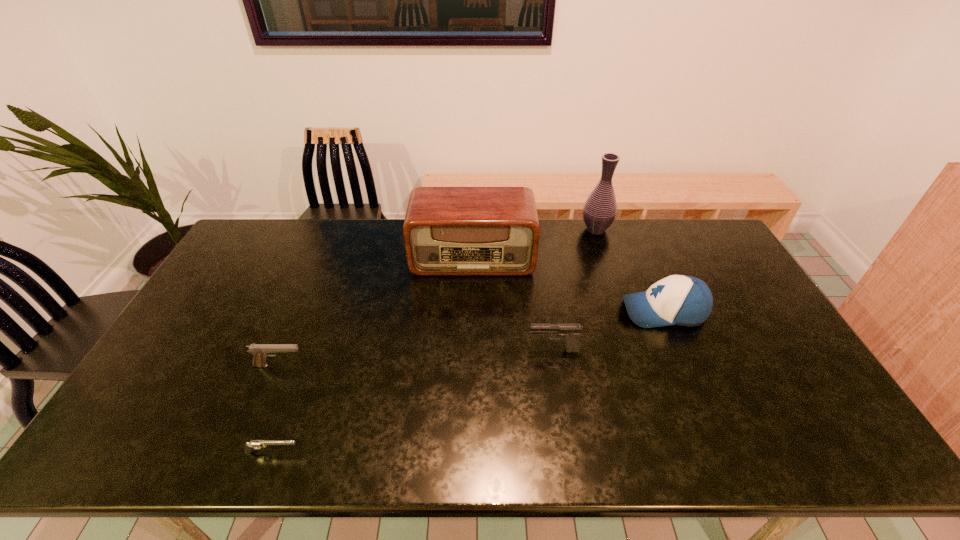
Identify the location of free space between the nearest pistol and the tallest object. The height and width of the screenshot is (540, 960). (434, 341).

Identify the location of free area in between the farthest object and the fourth shortest object. This screenshot has height=540, width=960. (630, 270).

Locate which object ranks second in proximity to the rightmost pistol. Please provide its 2D coordinates. Your answer should be formatted as a tuple, i.e. [(x, y)], where the tuple contains the x and y coordinates of a point satisfying the conditions above.

[(447, 230)]

Locate an element on the screen. This screenshot has width=960, height=540. object that is the nearest to the fourth tallest object is located at coordinates (682, 300).

Find the location of a particular element. The image size is (960, 540). pistol that is the third closest one to the tallest object is located at coordinates (253, 444).

At what (x,y) coordinates should I click in order to perform the action: click on the closest pistol to the shortest object. Please return your answer as a coordinate pair (x, y). The height and width of the screenshot is (540, 960). Looking at the image, I should click on (259, 351).

Where is `free location that satisfies the following two spatial constraints: 1. on the front panel of the fifth nearest object; 2. on the front-facing side of the nearest pistol`? The height and width of the screenshot is (540, 960). free location that satisfies the following two spatial constraints: 1. on the front panel of the fifth nearest object; 2. on the front-facing side of the nearest pistol is located at coordinates (468, 452).

The width and height of the screenshot is (960, 540). I want to click on free region that satisfies the following two spatial constraints: 1. on the front panel of the second farthest object; 2. at the barrel of the second shortest object, so click(470, 366).

At what (x,y) coordinates should I click in order to perform the action: click on free space that satisfies the following two spatial constraints: 1. on the front panel of the fifth shortest object; 2. at the barrel of the second nearest pistol. Please return your answer as a coordinate pair (x, y). This screenshot has width=960, height=540. Looking at the image, I should click on (470, 366).